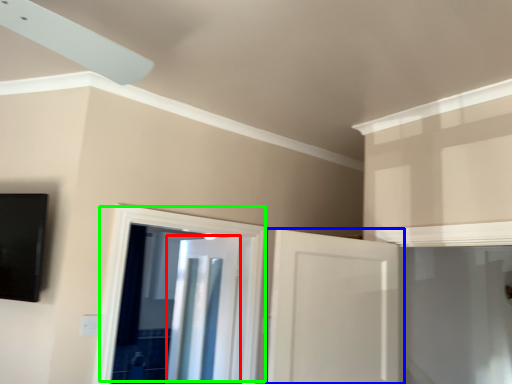
Question: Based on their relative distances, which object is nearer to door (highlighted by a red box)? Choose from door (highlighted by a blue box) and door (highlighted by a green box).

Choices:
 (A) door
 (B) door

Answer: (B)